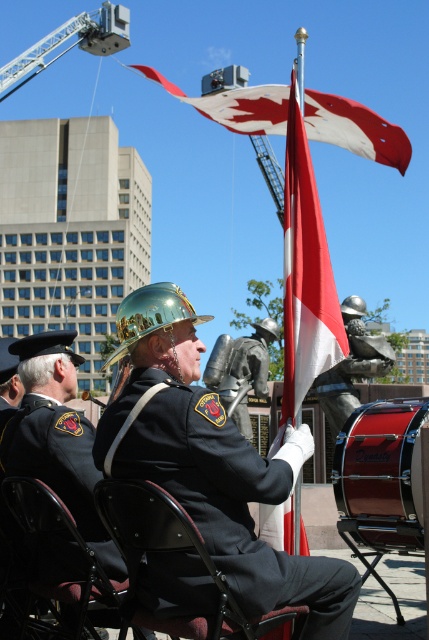
Which is more to the right, red/white fabric flag at center or red/white fabric flag at upper center?

From the viewer's perspective, red/white fabric flag at center appears more on the right side.

Does red/white fabric flag at center have a larger size compared to red/white fabric flag at upper center?

Actually, red/white fabric flag at center might be smaller than red/white fabric flag at upper center.

The height and width of the screenshot is (640, 429). What do you see at coordinates (305, 278) in the screenshot?
I see `red/white fabric flag at center` at bounding box center [305, 278].

The height and width of the screenshot is (640, 429). What are the coordinates of `red/white fabric flag at center` in the screenshot? It's located at (305, 278).

Does metallic silver chair at center appear over metallic helmet at center?

Incorrect, metallic silver chair at center is not positioned above metallic helmet at center.

Is metallic silver chair at center closer to the viewer compared to metallic helmet at center?

Yes.

The width and height of the screenshot is (429, 640). Find the location of `metallic silver chair at center`. metallic silver chair at center is located at coordinates [68, 538].

Looking at this image, who is positioned more to the left, red/white fabric flag at center or metallic helmet at center?

From the viewer's perspective, metallic helmet at center appears more on the left side.

Who is shorter, red/white fabric flag at center or metallic helmet at center?

Standing shorter between the two is metallic helmet at center.

This screenshot has height=640, width=429. I want to click on red/white fabric flag at center, so click(305, 278).